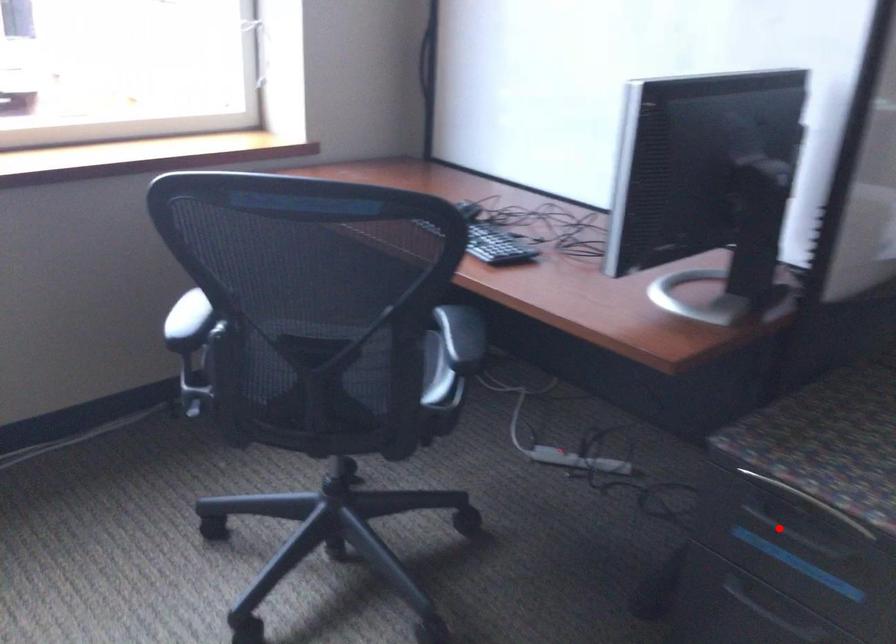
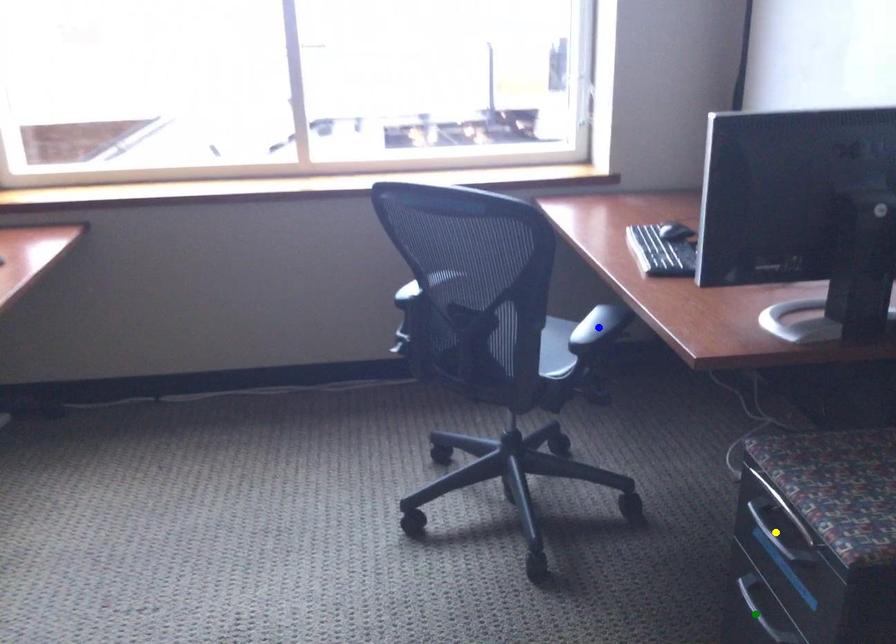
Question: I am providing you with two images of the same scene from different viewpoints. A red point is marked on the first image. You are given multiple points on the second image. In image 2, which mark is for the same physical point as the one in image 1?

Choices:
 (A) blue point
 (B) yellow point
 (C) green point

Answer: (B)